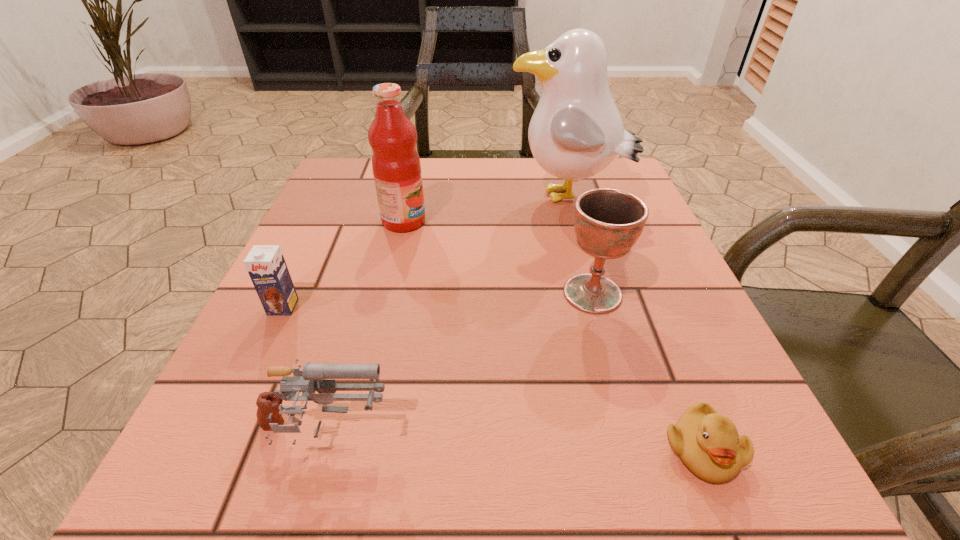
At what (x,y) coordinates should I click in order to perform the action: click on the tallest object. Please return your answer as a coordinate pair (x, y). This screenshot has height=540, width=960. Looking at the image, I should click on (576, 131).

The height and width of the screenshot is (540, 960). Identify the location of fruit juice. (396, 166).

You are a GUI agent. You are given a task and a screenshot of the screen. Output one action in this format:
    pyautogui.click(x=<x>, y=<y>)
    Task: Click on the chalice
    
    Given the screenshot: What is the action you would take?
    pyautogui.click(x=608, y=222)

Locate an element on the screen. the leftmost object is located at coordinates (266, 265).

Find the location of a particular element. This screenshot has height=540, width=960. gun is located at coordinates (269, 413).

Locate an element on the screen. The image size is (960, 540). the shortest object is located at coordinates (708, 443).

Find the location of `free space located on the beak of the tallest object`. free space located on the beak of the tallest object is located at coordinates (440, 198).

Where is `blank area located on the beak of the tallest object`? This screenshot has width=960, height=540. blank area located on the beak of the tallest object is located at coordinates click(347, 198).

Locate an element on the screen. vacant area situated on the beak of the tallest object is located at coordinates (485, 198).

I want to click on free spot located 0.080m on the front label of the fruit juice, so click(465, 221).